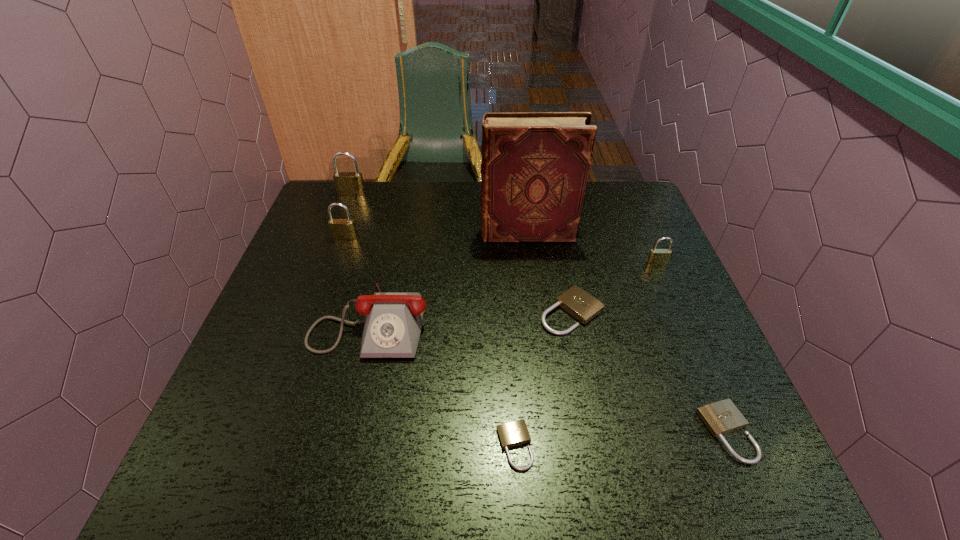
The height and width of the screenshot is (540, 960). In order to click on the tallest object in this screenshot , I will do pos(535,165).

Where is `the farthest padlock`? Image resolution: width=960 pixels, height=540 pixels. the farthest padlock is located at coordinates (350, 184).

You are a GUI agent. You are given a task and a screenshot of the screen. Output one action in this format:
    pyautogui.click(x=<x>, y=<y>)
    Task: Click on the seventh shortest object
    
    Given the screenshot: What is the action you would take?
    pyautogui.click(x=350, y=184)

What are the coordinates of `the fifth shortest padlock` in the screenshot? It's located at (341, 229).

You are a GUI agent. You are given a task and a screenshot of the screen. Output one action in this format:
    pyautogui.click(x=<x>, y=<y>)
    Task: Click on the fifth nearest padlock
    
    Given the screenshot: What is the action you would take?
    pyautogui.click(x=341, y=229)

At what (x,y) coordinates should I click in order to perform the action: click on telephone. Please return your answer as a coordinate pair (x, y). Looking at the image, I should click on (393, 324).

Where is `the smallest brass padlock`? The image size is (960, 540). the smallest brass padlock is located at coordinates (657, 256).

Find the location of a particular element. The image size is (960, 540). the fourth farthest object is located at coordinates (657, 256).

This screenshot has height=540, width=960. I want to click on the sixth tallest object, so click(577, 302).

Where is `the fourth farthest padlock`? Image resolution: width=960 pixels, height=540 pixels. the fourth farthest padlock is located at coordinates (577, 302).